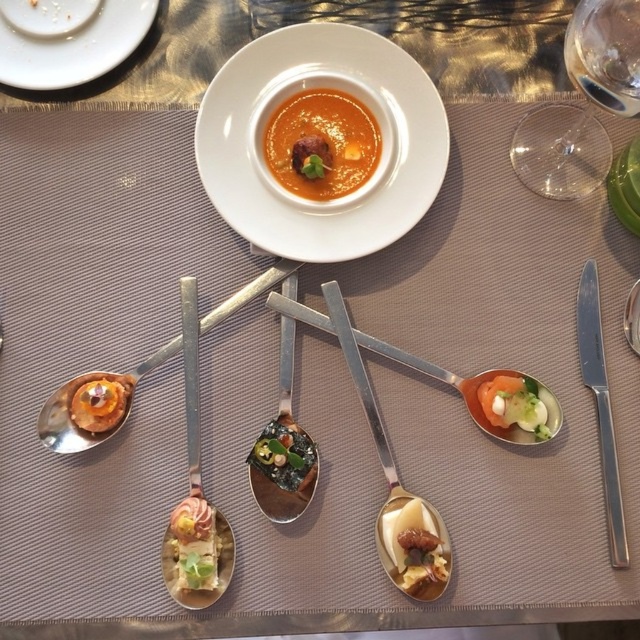
You are a diner at this table and want to reach for both the transparent glass at upper right and the matte gold spoon at lower left. Since you can only choose one to grab first, which one should you pick to ensure you can easily reach the other afterward?

You should grab the transparent glass at upper right first because it is above the matte gold spoon at lower left, so moving from top to bottom will allow easier access to the spoon afterward.

You are a food critic sitting at the table and want to taste the soup in the white bowl. You notice the white glossy plate at upper left and the shiny silver spoon at center. Which object is closer to the soup?

The shiny silver spoon at center is closer to the soup because the white glossy plate at upper left is located above it, meaning the spoon is nearer to the soup than the plate.